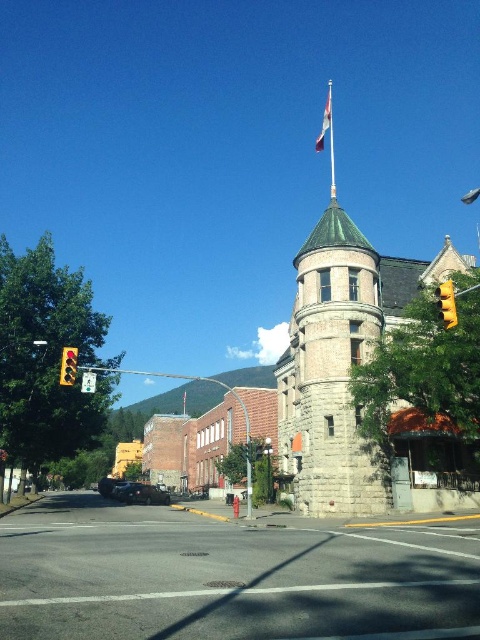
Question: Which point appears farthest from the camera in this image?

Choices:
 (A) (448, 326)
 (B) (183, 410)
 (C) (327, 97)
 (D) (147, 500)

Answer: (C)

Question: Among these objects, which one is farthest from the camera?

Choices:
 (A) yellow matte traffic light at right
 (B) gray stone tower at center
 (C) yellow plastic traffic light at left
 (D) white fabric flag at upper center

Answer: (D)

Question: Is yellow matte traffic light at right below yellow plastic traffic light at left?

Choices:
 (A) yes
 (B) no

Answer: (B)

Question: Does gray stone tower at center appear on the left side of metallic flag pole at upper center?

Choices:
 (A) yes
 (B) no

Answer: (A)

Question: Considering the relative positions of yellow matte traffic light at right and metallic flag pole at upper center in the image provided, where is yellow matte traffic light at right located with respect to metallic flag pole at upper center?

Choices:
 (A) right
 (B) left

Answer: (B)

Question: Estimate the real-world distances between objects in this image. Which object is farther from the gray stone building at center?

Choices:
 (A) metallic flag pole at upper center
 (B) yellow plastic traffic light at left
 (C) white fabric flag at upper center
 (D) gray stone tower at center

Answer: (C)